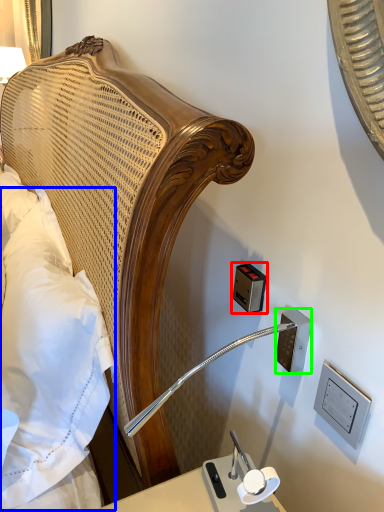
Question: Estimate the real-world distances between objects in this image. Which object is closer to electric outlet (highlighted by a red box), pillow (highlighted by a blue box) or electric outlet (highlighted by a green box)?

Choices:
 (A) pillow
 (B) electric outlet

Answer: (B)